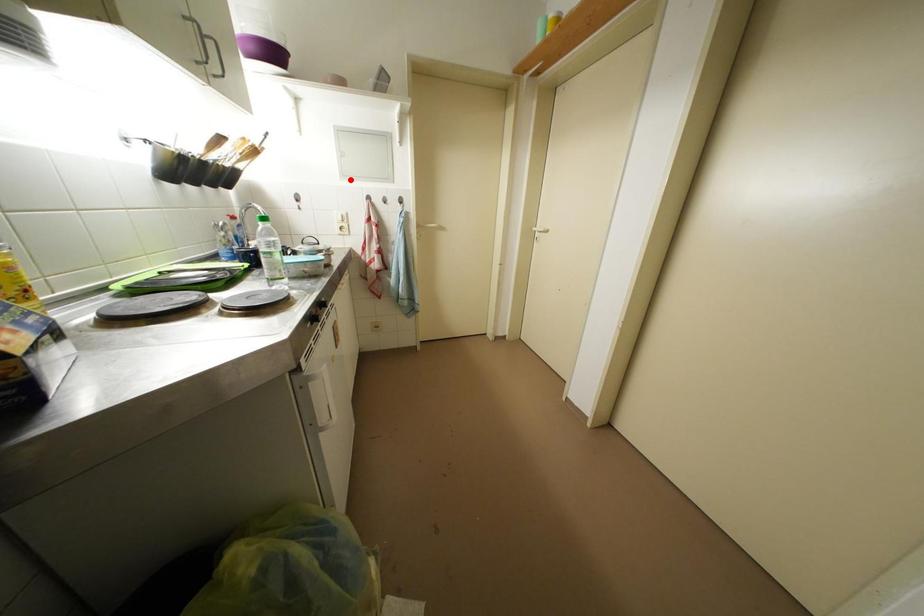
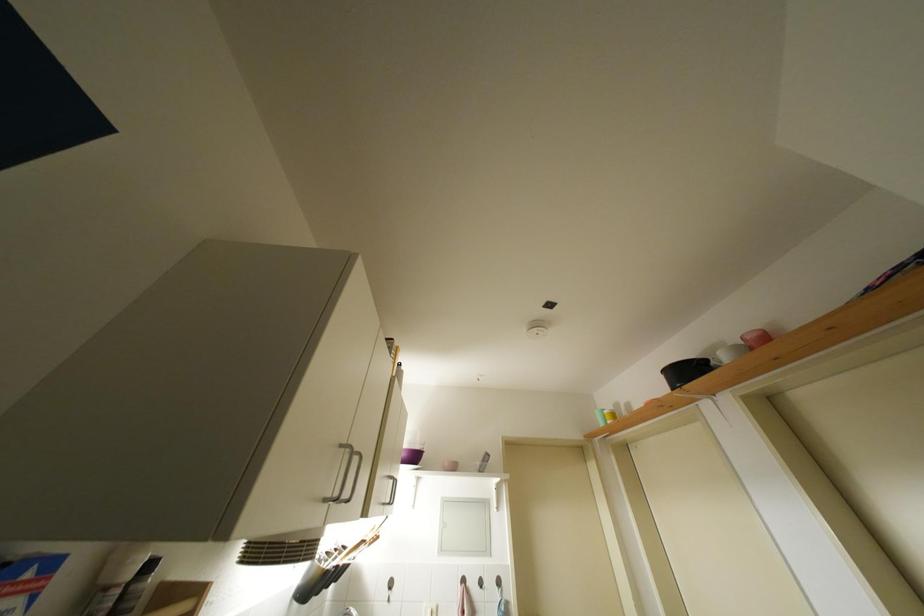
In the second image, find the point that corresponds to the highlighted location in the first image.

(447, 554)